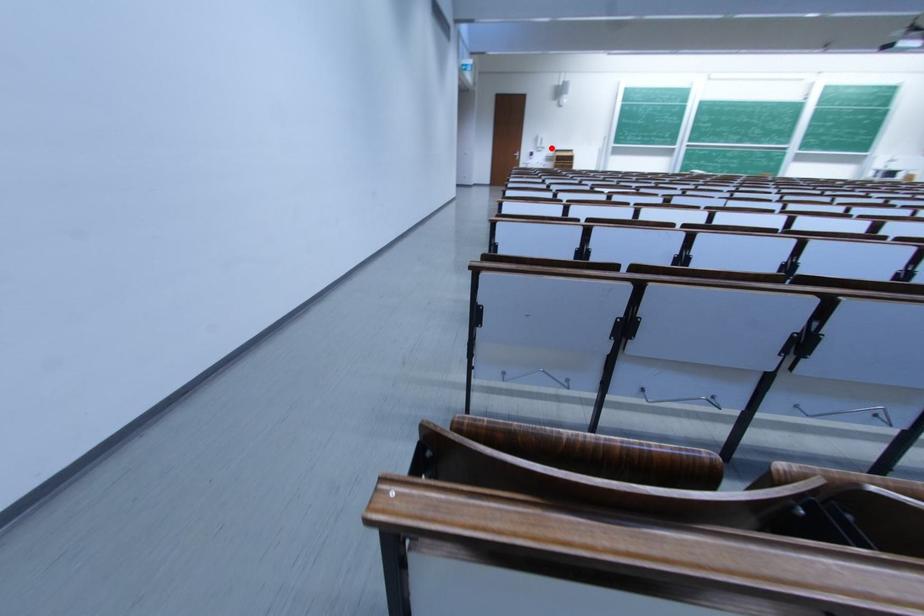
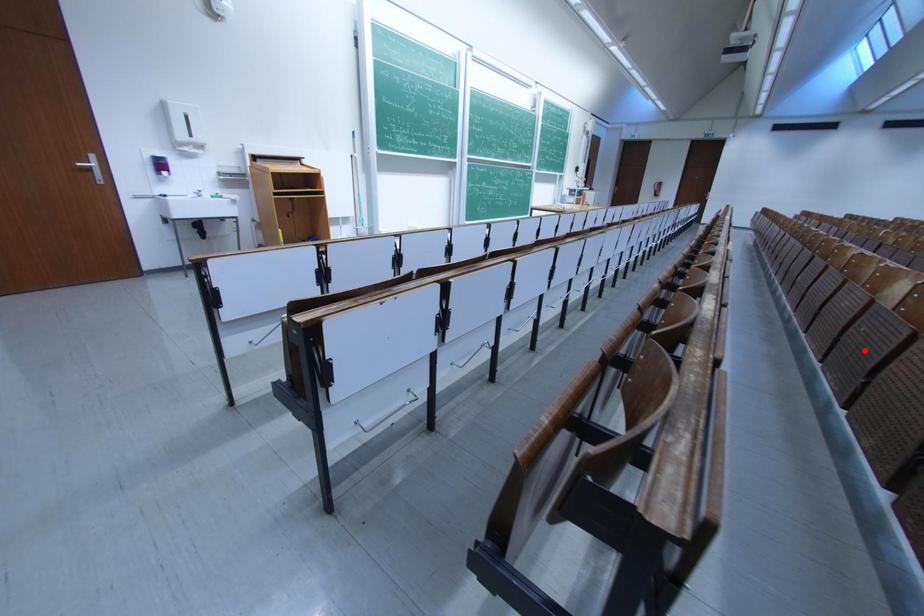
I am providing you with two images of the same scene from different viewpoints. A red point is marked on the first image and another point is marked on the second image. Are the points marked in image1 and image2 representing the same 3D position?

No